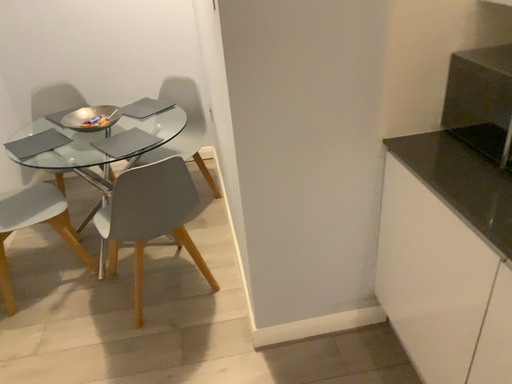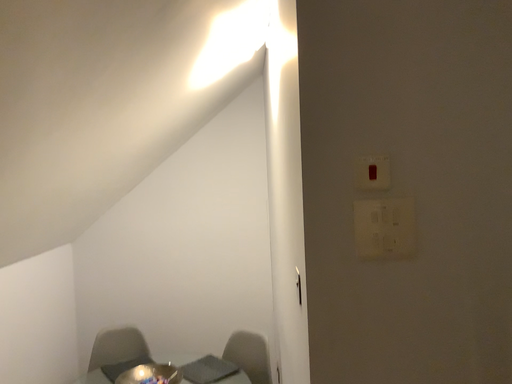
Question: Which way did the camera rotate in the video?

Choices:
 (A) rotated right
 (B) rotated left

Answer: (B)